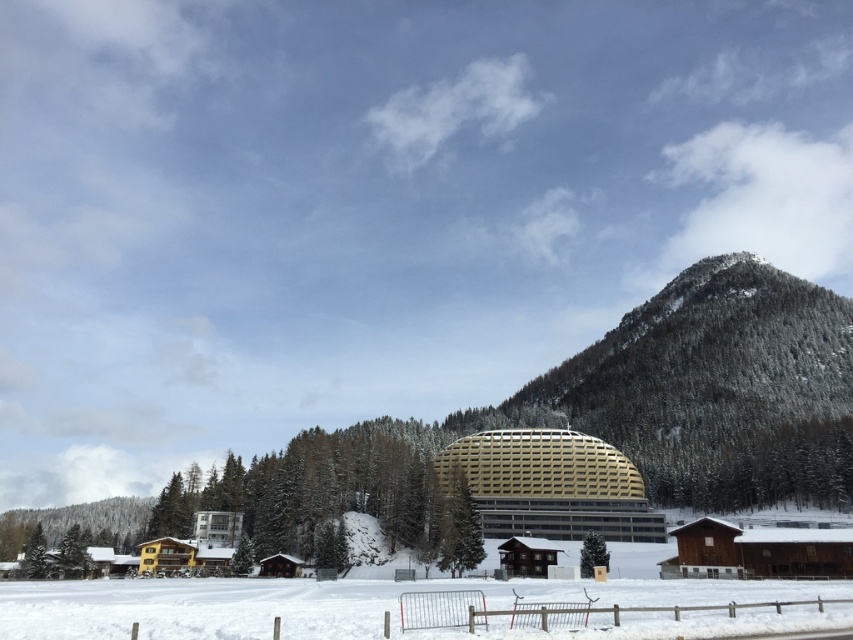
Can you confirm if green textured mountain at center is positioned to the right of gold metallic dome at center?

Indeed, green textured mountain at center is positioned on the right side of gold metallic dome at center.

Image resolution: width=853 pixels, height=640 pixels. What are the coordinates of `green textured mountain at center` in the screenshot? It's located at (572, 422).

Where is `green textured mountain at center`? green textured mountain at center is located at coordinates 572,422.

Looking at this image, which is more to the right, green textured mountain at center or white powdery snow at lower center?

green textured mountain at center

Where is `green textured mountain at center`? This screenshot has height=640, width=853. green textured mountain at center is located at coordinates (572, 422).

Does point (506, 608) come closer to viewer compared to point (451, 483)?

Yes, it is.

At what (x,y) coordinates should I click in order to perform the action: click on white powdery snow at lower center. Please return your answer as a coordinate pair (x, y). Image resolution: width=853 pixels, height=640 pixels. Looking at the image, I should click on (381, 605).

Where is `white powdery snow at lower center`? Image resolution: width=853 pixels, height=640 pixels. white powdery snow at lower center is located at coordinates (381, 605).